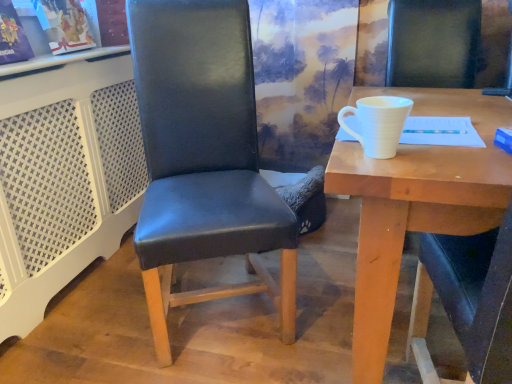
Identify the location of vacant space in black leather chair at center (from a real-world perspective). (221, 309).